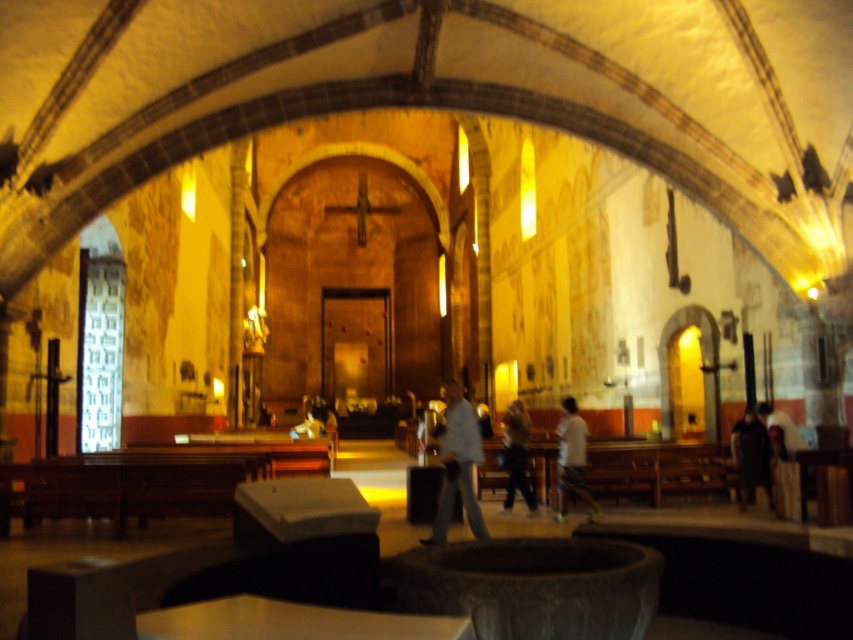
Is point (459, 413) positioned after point (519, 490)?

No, it is not.

Looking at this image, is light gray fabric pants at center thinner than light brown leather jacket at center?

Indeed, light gray fabric pants at center has a lesser width compared to light brown leather jacket at center.

Locate an element on the screen. This screenshot has width=853, height=640. light gray fabric pants at center is located at coordinates (457, 465).

Where is `light gray fabric pants at center`? This screenshot has width=853, height=640. light gray fabric pants at center is located at coordinates (457, 465).

Can you confirm if white cotton shirt at center is shorter than light brown leather jacket at center?

Yes.

From the picture: Who is more distant from viewer, (585, 433) or (509, 440)?

Positioned behind is point (509, 440).

Locate an element on the screen. The image size is (853, 640). white cotton shirt at center is located at coordinates pos(572,460).

Is light gray fabric pants at center closer to the viewer compared to white cotton shirt at center?

Yes, light gray fabric pants at center is in front of white cotton shirt at center.

Between light gray fabric pants at center and white cotton shirt at center, which one has more height?

light gray fabric pants at center

Locate an element on the screen. This screenshot has width=853, height=640. light gray fabric pants at center is located at coordinates [x=457, y=465].

At what (x,y) coordinates should I click in order to perform the action: click on light gray fabric pants at center. Please return your answer as a coordinate pair (x, y). Looking at the image, I should click on (457, 465).